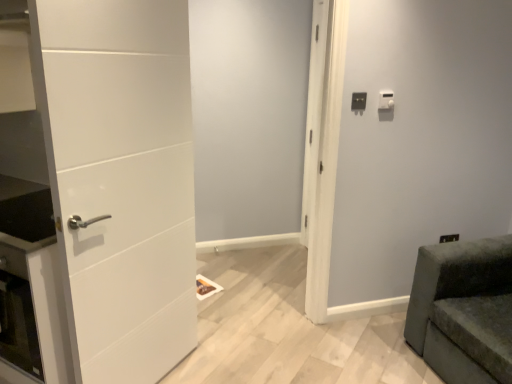
The width and height of the screenshot is (512, 384). What are the coordinates of `free spot behind white matte door at center` in the screenshot? It's located at (257, 299).